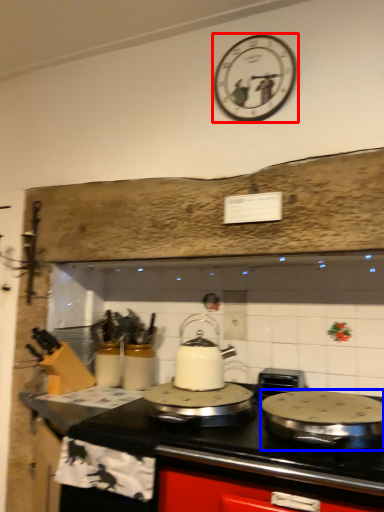
Question: Which object appears closest to the camera in this image, wall clock (highlighted by a red box) or kitchen appliance (highlighted by a blue box)?

Choices:
 (A) wall clock
 (B) kitchen appliance

Answer: (B)